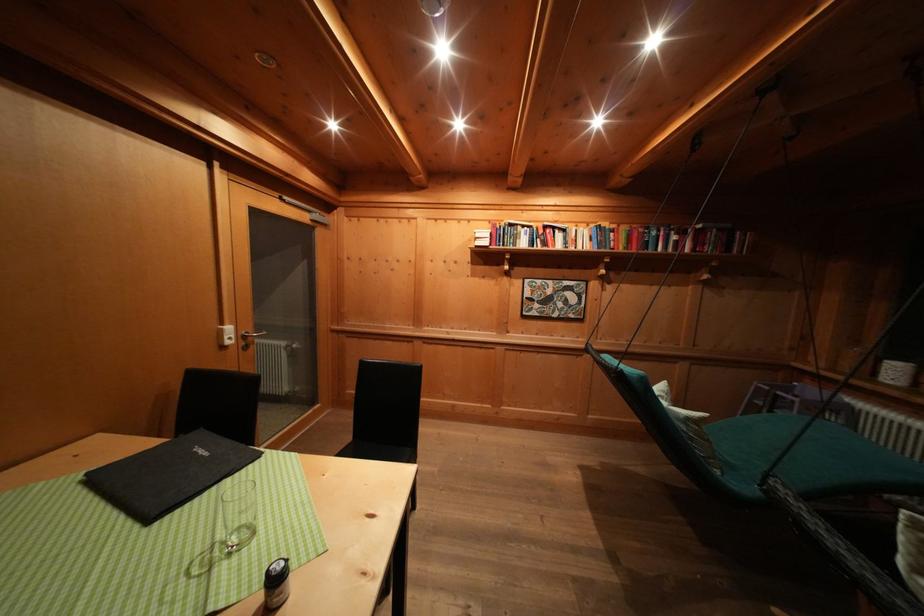
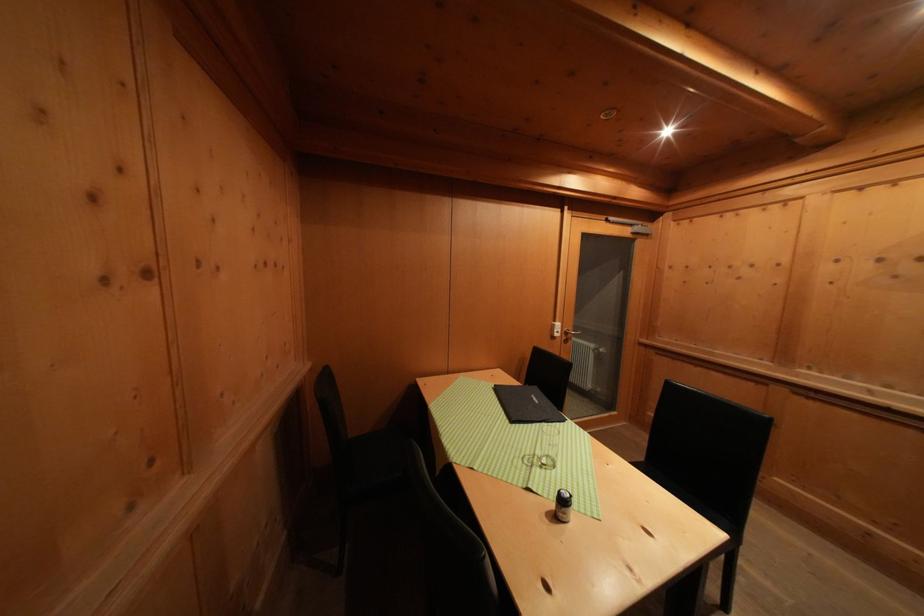
Question: Based on the continuous images, in which direction is the camera rotating? Reply with the corresponding letter.

Choices:
 (A) Left
 (B) Right
 (C) Up
 (D) Down

Answer: (A)